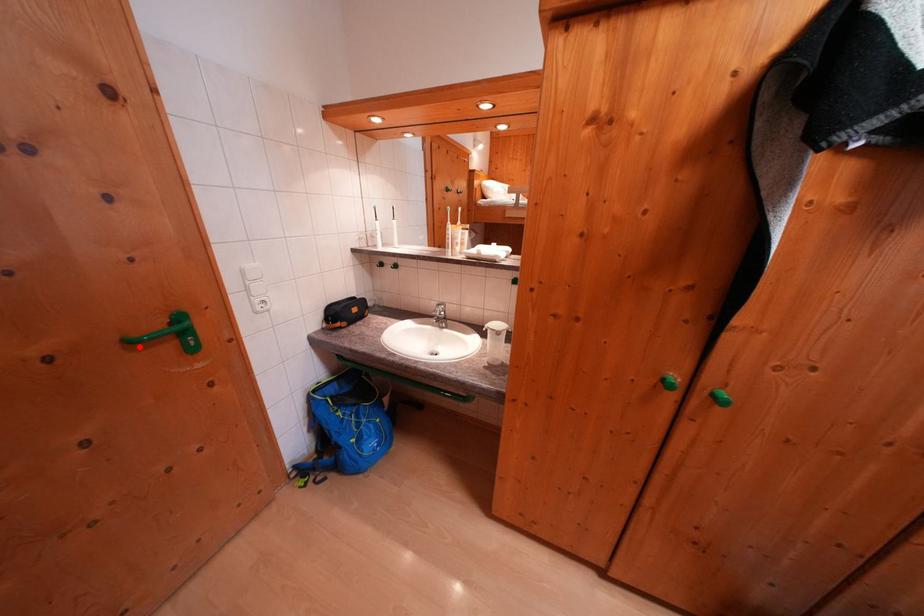
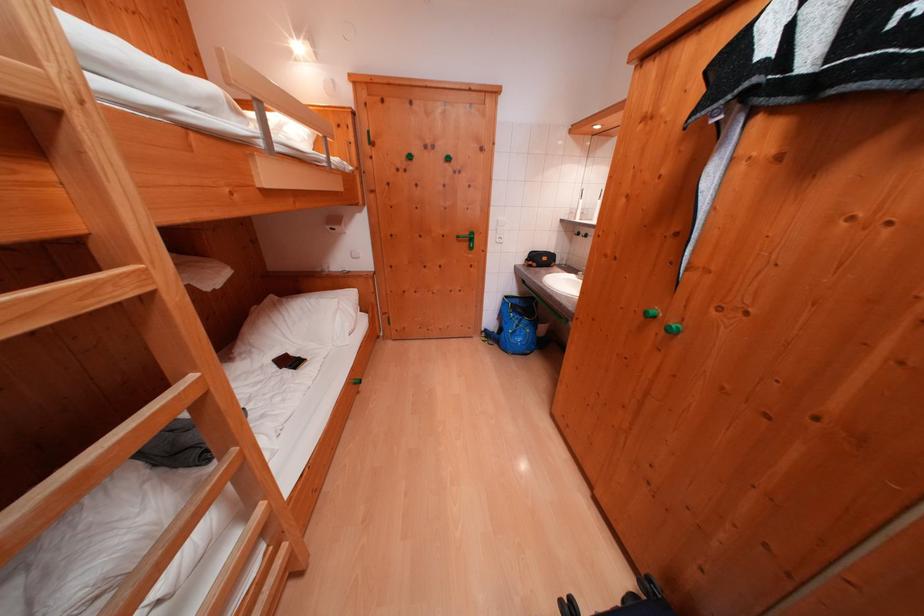
Where in the second image is the point corresponding to the highlighted location from the first image?

(466, 241)